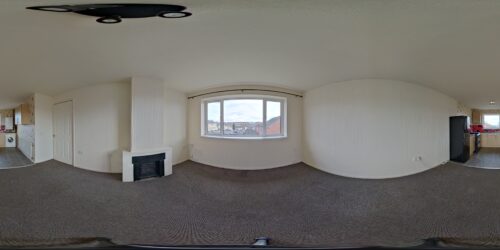
Locate an element on the screen. The image size is (500, 250). ceiling lights is located at coordinates pos(97,13).